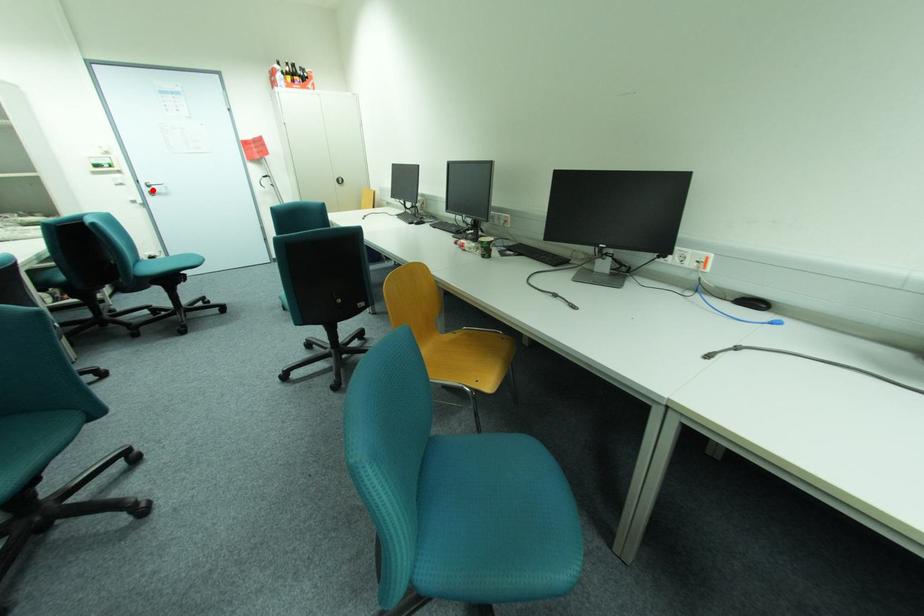
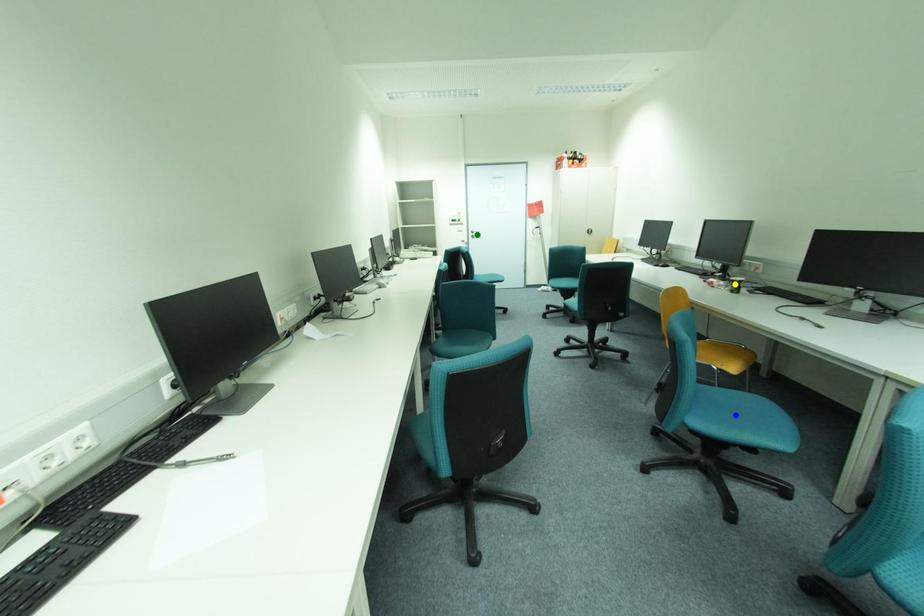
Question: I am providing you with two images of the same scene from different viewpoints. A red point is marked on the first image. You are given multiple points on the second image. Which mark in image 2 goes with the point in image 1?

Choices:
 (A) green point
 (B) blue point
 (C) yellow point

Answer: (A)